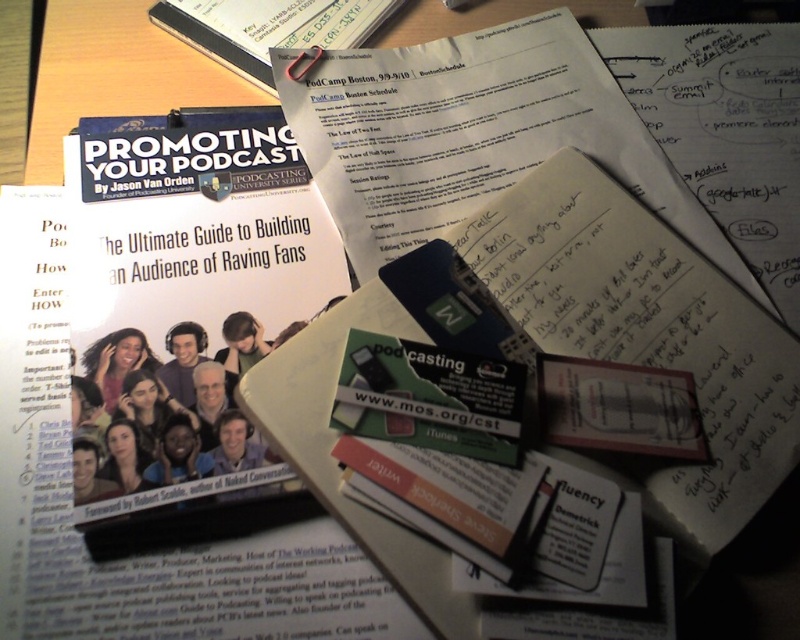
What are the coordinates of the white paper at center?

The white paper at center is located at coordinates point (494, 140).

You are a photographer aiming to capture a closeup of the white paper at center. The camera you are using has a minimum focusing distance of 50 centimeters. Can you take the photo without moving the paper?

The white paper at center is 53.43 centimeters from the camera, which is beyond the minimum focusing distance of 50 centimeters. Therefore, you can take the photo without moving the paper.

You are organizing your desk and need to place the white paper at center and the matte black book at upper center into a folder. Which item should you place first if you want to ensure the folder can fit both items without overlapping?

You should place the matte black book at upper center first because the white paper at center might be wider than it, so placing the wider item first ensures there is enough space for both in the folder.